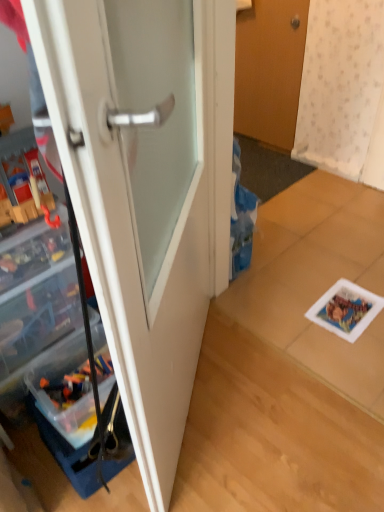
Where is `unoccupied region to the right of white glossy door at center, the 2th door from the top`? Image resolution: width=384 pixels, height=512 pixels. unoccupied region to the right of white glossy door at center, the 2th door from the top is located at coordinates point(277,402).